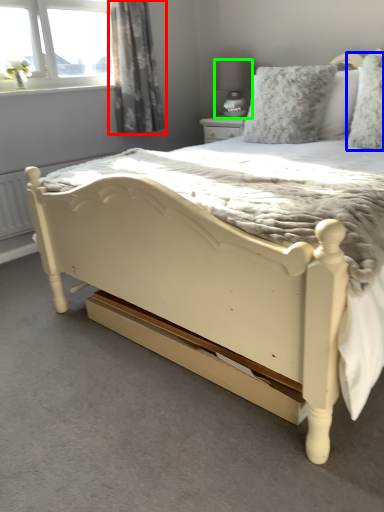
Question: Which object is positioned closest to curtain (highlighted by a red box)? Select from pillow (highlighted by a blue box) and lamp (highlighted by a green box).

Choices:
 (A) pillow
 (B) lamp

Answer: (B)